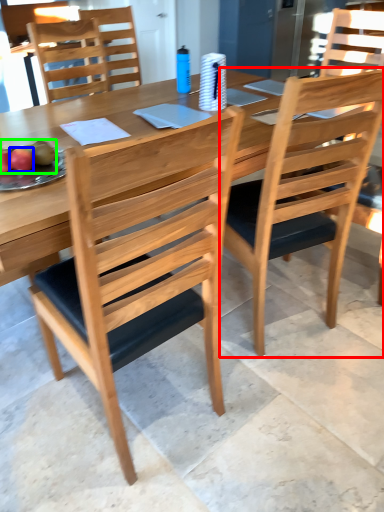
Question: Considering the real-world distances, which object is farthest from chair (highlighted by a red box)? fruit (highlighted by a blue box) or fruit (highlighted by a green box)?

Choices:
 (A) fruit
 (B) fruit

Answer: (A)